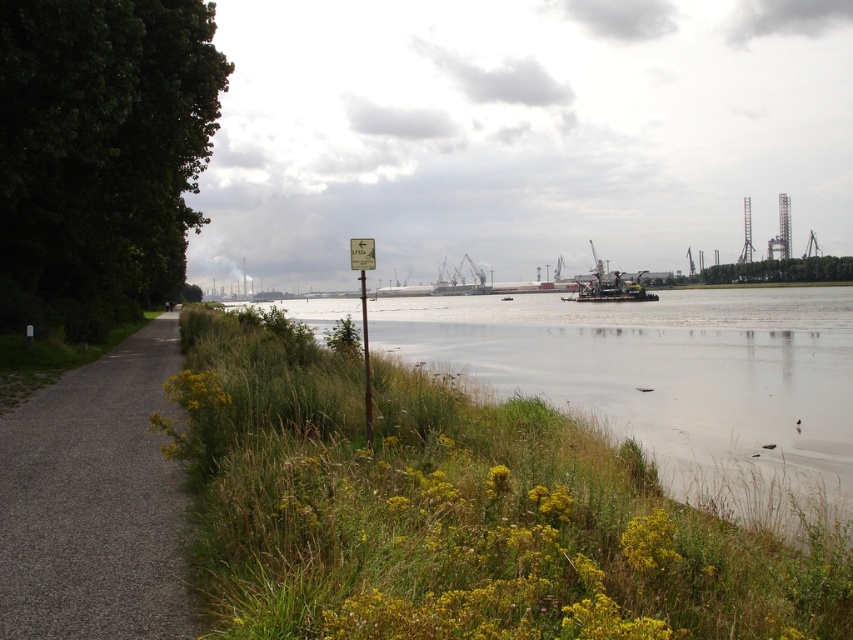
Consider the image. You are a hiker carrying a 1.2 meter wide tent. You need to set up camp along the gravel path at left and the green plastic sign at center. Based on their widths, which location can accommodate your tent without overlapping onto other areas?

The gravel path at left has a larger width than the green plastic sign at center, so the gravel path at left can accommodate the 1.2 meter wide tent without overlapping onto other areas.

You are a hiker who wants to know if you can see the green plastic sign at center from the gravel path at left without any obstruction. Based on the scene, can you determine if the sign is visible?

The gravel path at left is taller than green plastic sign at center, so the sign might be partially or fully obscured by the height difference between the path and the sign.

You are standing at the riverside and want to determine which of the two points, point (x=12, y=612) or point (x=364, y=257), is closer to you. Based on the scene, which point is nearer?

Point (x=12, y=612) is closer to the viewer than point (x=364, y=257).